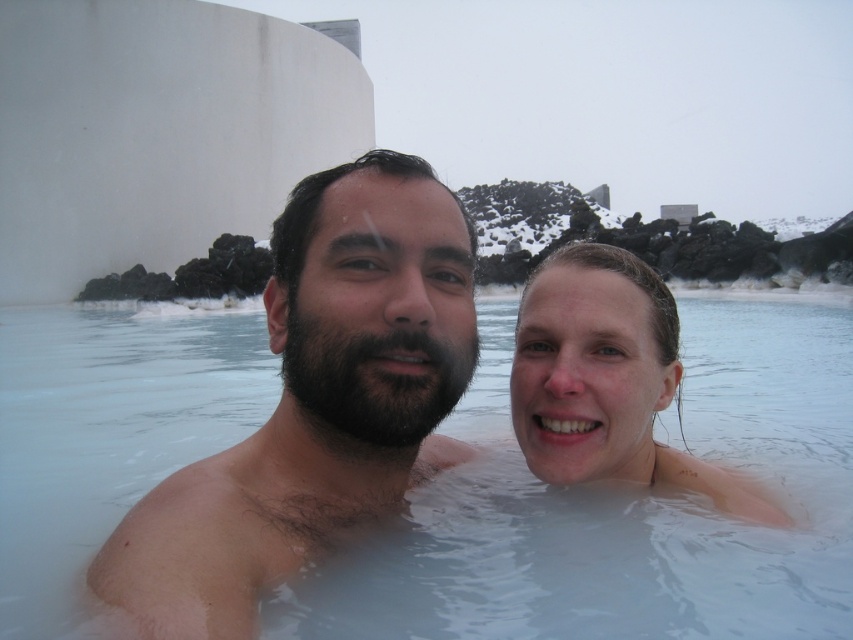
You are a photographer standing near the Blue Lagoon in Iceland. You want to capture a photo of the smooth skin man at center and the smooth skin face at center. Since you want to ensure both are in focus, you need to know which one is taller. Which one is taller?

The smooth skin man at center is taller than the smooth skin face at center.